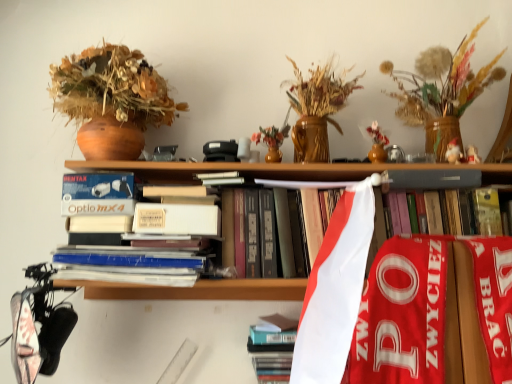
Where is `matte brown vase at upper left`? matte brown vase at upper left is located at coordinates (111, 100).

The image size is (512, 384). Describe the element at coordinates (111, 100) in the screenshot. I see `matte brown vase at upper left` at that location.

Where is `wooden vase with dried flowers at upper right`? The image size is (512, 384). wooden vase with dried flowers at upper right is located at coordinates (441, 90).

This screenshot has width=512, height=384. What do you see at coordinates (441, 90) in the screenshot?
I see `wooden vase with dried flowers at upper right` at bounding box center [441, 90].

Identify the location of hardcover book at center, which ranks as the 2th book in top-to-bottom order. The width and height of the screenshot is (512, 384). (272, 348).

Where is `hardcover book at center, acting as the second book starting from the bottom`? hardcover book at center, acting as the second book starting from the bottom is located at coordinates (451, 177).

Is hardcover book at center, marked as the 1th book in a bottom-to-top arrangement, wider or thinner than wooden vase with dried flowers at upper right?

Considering their sizes, hardcover book at center, marked as the 1th book in a bottom-to-top arrangement, looks slimmer than wooden vase with dried flowers at upper right.

Is hardcover book at center, marked as the 1th book in a bottom-to-top arrangement, not close to wooden vase with dried flowers at upper right?

hardcover book at center, marked as the 1th book in a bottom-to-top arrangement, is near wooden vase with dried flowers at upper right, not far away.

Is hardcover book at center, which ranks as the 2th book in top-to-bottom order, completely or partially outside of wooden vase with dried flowers at upper right?

Absolutely, hardcover book at center, which ranks as the 2th book in top-to-bottom order, is external to wooden vase with dried flowers at upper right.

Considering the positions of objects hardcover book at center, which is counted as the 1th book, starting from the top, and hardcover book at center, marked as the 1th book in a bottom-to-top arrangement, in the image provided, who is more to the left, hardcover book at center, which is counted as the 1th book, starting from the top, or hardcover book at center, marked as the 1th book in a bottom-to-top arrangement,?

Positioned to the left is hardcover book at center, marked as the 1th book in a bottom-to-top arrangement.

Considering the sizes of objects hardcover book at center, which is counted as the 1th book, starting from the top, and hardcover book at center, which ranks as the 2th book in top-to-bottom order, in the image provided, who is wider, hardcover book at center, which is counted as the 1th book, starting from the top, or hardcover book at center, which ranks as the 2th book in top-to-bottom order,?

hardcover book at center, which is counted as the 1th book, starting from the top, is wider.

From the image's perspective, does hardcover book at center, which is counted as the 1th book, starting from the top, appear higher than hardcover book at center, which ranks as the 2th book in top-to-bottom order?

Yes, from the image's perspective, hardcover book at center, which is counted as the 1th book, starting from the top, is over hardcover book at center, which ranks as the 2th book in top-to-bottom order.

Is hardcover book at center, which is counted as the 1th book, starting from the top, looking in the opposite direction of hardcover book at center, marked as the 1th book in a bottom-to-top arrangement?

No, hardcover book at center, which is counted as the 1th book, starting from the top, is not facing away from hardcover book at center, marked as the 1th book in a bottom-to-top arrangement.

From the image's perspective, is hardcover book at center, which ranks as the 2th book in top-to-bottom order, positioned above or below hardcover book at center, which is counted as the 1th book, starting from the top?

hardcover book at center, which ranks as the 2th book in top-to-bottom order, is situated lower than hardcover book at center, which is counted as the 1th book, starting from the top, in the image.

Which of these two, hardcover book at center, which ranks as the 2th book in top-to-bottom order, or hardcover book at center, acting as the second book starting from the bottom, stands taller?

Standing taller between the two is hardcover book at center, acting as the second book starting from the bottom.

Is hardcover book at center, which ranks as the 2th book in top-to-bottom order, aimed at hardcover book at center, which is counted as the 1th book, starting from the top?

No, hardcover book at center, which ranks as the 2th book in top-to-bottom order, is not aimed at hardcover book at center, which is counted as the 1th book, starting from the top.

Considering the sizes of hardcover book at center, which ranks as the 2th book in top-to-bottom order, and hardcover book at center, which is counted as the 1th book, starting from the top, in the image, is hardcover book at center, which ranks as the 2th book in top-to-bottom order, bigger or smaller than hardcover book at center, which is counted as the 1th book, starting from the top,?

In the image, hardcover book at center, which ranks as the 2th book in top-to-bottom order, appears to be smaller than hardcover book at center, which is counted as the 1th book, starting from the top.

How many degrees apart are the facing directions of matte brown vase at upper left and hardcover book at center, which ranks as the 2th book in top-to-bottom order?

The angular difference between matte brown vase at upper left and hardcover book at center, which ranks as the 2th book in top-to-bottom order, is 2.05 degrees.

Which object is positioned more to the left, matte brown vase at upper left or hardcover book at center, which ranks as the 2th book in top-to-bottom order?

From the viewer's perspective, matte brown vase at upper left appears more on the left side.

Identify the location of houseplant to the left of hardcover book at center, marked as the 1th book in a bottom-to-top arrangement. The height and width of the screenshot is (384, 512). (111, 100).

How far apart are hardcover book at center, which is counted as the 1th book, starting from the top, and matte brown vase at upper left?

8.87 inches.

Can you tell me how much hardcover book at center, which is counted as the 1th book, starting from the top, and matte brown vase at upper left differ in facing direction?

hardcover book at center, which is counted as the 1th book, starting from the top, and matte brown vase at upper left are facing 1.4 degrees away from each other.

Consider the image. Is hardcover book at center, which is counted as the 1th book, starting from the top, situated inside matte brown vase at upper left or outside?

hardcover book at center, which is counted as the 1th book, starting from the top, is outside matte brown vase at upper left.

Which object is thinner, hardcover book at center, acting as the second book starting from the bottom, or matte brown vase at upper left?

hardcover book at center, acting as the second book starting from the bottom.

Considering the sizes of objects wooden vase with dried flowers at upper right and hardcover book at center, marked as the 1th book in a bottom-to-top arrangement, in the image provided, who is taller, wooden vase with dried flowers at upper right or hardcover book at center, marked as the 1th book in a bottom-to-top arrangement,?

Standing taller between the two is wooden vase with dried flowers at upper right.

Is wooden vase with dried flowers at upper right not close to hardcover book at center, which ranks as the 2th book in top-to-bottom order?

wooden vase with dried flowers at upper right is actually quite close to hardcover book at center, which ranks as the 2th book in top-to-bottom order.

From a real-world perspective, which object rests below the other?

In real-world perspective, hardcover book at center, marked as the 1th book in a bottom-to-top arrangement, is lower.

Is wooden vase with dried flowers at upper right taller than matte brown vase at upper left?

No.

Is wooden vase with dried flowers at upper right to the left or to the right of matte brown vase at upper left in the image?

wooden vase with dried flowers at upper right is to the right of matte brown vase at upper left.

Find the location of `floral arrangement located in front of the hardcover book at center, which ranks as the 2th book in top-to-bottom order`. floral arrangement located in front of the hardcover book at center, which ranks as the 2th book in top-to-bottom order is located at coordinates (441, 90).

Image resolution: width=512 pixels, height=384 pixels. I want to click on book on the left of hardcover book at center, which is counted as the 1th book, starting from the top, so click(x=272, y=348).

Based on their spatial positions, is wooden vase with dried flowers at upper right or matte brown vase at upper left further from hardcover book at center, which is counted as the 1th book, starting from the top?

wooden vase with dried flowers at upper right lies further to hardcover book at center, which is counted as the 1th book, starting from the top, than the other object.

From the image, which object appears to be nearer to hardcover book at center, which ranks as the 2th book in top-to-bottom order, matte brown vase at upper left or wooden vase with dried flowers at upper right?

The object closer to hardcover book at center, which ranks as the 2th book in top-to-bottom order, is matte brown vase at upper left.

From the image, which object appears to be farther from matte brown vase at upper left, hardcover book at center, marked as the 1th book in a bottom-to-top arrangement, or hardcover book at center, which is counted as the 1th book, starting from the top?

Among the two, hardcover book at center, marked as the 1th book in a bottom-to-top arrangement, is located further to matte brown vase at upper left.

Estimate the real-world distances between objects in this image. Which object is further from wooden vase with dried flowers at upper right, matte brown vase at upper left or hardcover book at center, which is counted as the 1th book, starting from the top?

The object further to wooden vase with dried flowers at upper right is matte brown vase at upper left.

From the picture: Looking at the image, which one is located further to matte brown vase at upper left, hardcover book at center, acting as the second book starting from the bottom, or hardcover book at center, marked as the 1th book in a bottom-to-top arrangement?

Among the two, hardcover book at center, marked as the 1th book in a bottom-to-top arrangement, is located further to matte brown vase at upper left.

Considering their positions, is hardcover book at center, which ranks as the 2th book in top-to-bottom order, positioned further to hardcover book at center, which is counted as the 1th book, starting from the top, than wooden vase with dried flowers at upper right?

hardcover book at center, which ranks as the 2th book in top-to-bottom order.

Estimate the real-world distances between objects in this image. Which object is further from matte brown vase at upper left, wooden vase with dried flowers at upper right or hardcover book at center, marked as the 1th book in a bottom-to-top arrangement?

Based on the image, wooden vase with dried flowers at upper right appears to be further to matte brown vase at upper left.

Looking at the image, which one is located closer to hardcover book at center, which is counted as the 1th book, starting from the top, matte brown vase at upper left or wooden vase with dried flowers at upper right?

matte brown vase at upper left lies closer to hardcover book at center, which is counted as the 1th book, starting from the top, than the other object.

Identify the location of book between matte brown vase at upper left and hardcover book at center, which is counted as the 1th book, starting from the top, in the horizontal direction. Image resolution: width=512 pixels, height=384 pixels. (272, 348).

The height and width of the screenshot is (384, 512). What are the coordinates of `book between wooden vase with dried flowers at upper right and hardcover book at center, marked as the 1th book in a bottom-to-top arrangement, in the up-down direction` in the screenshot? It's located at (451, 177).